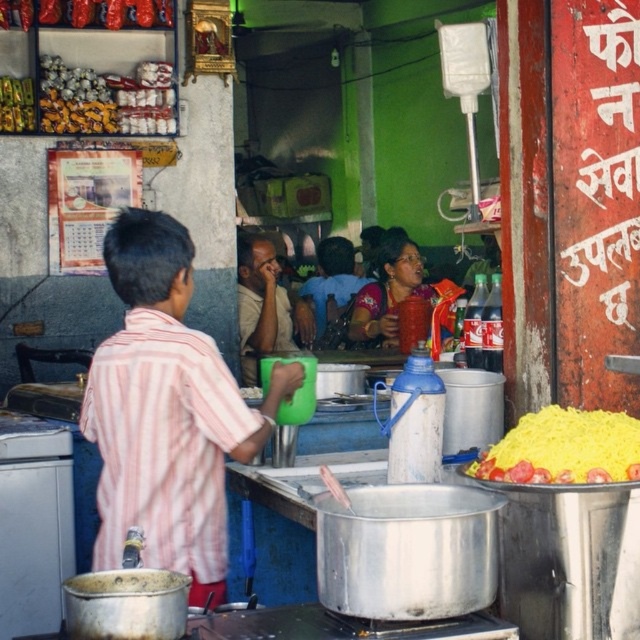
You are a customer at the food stall and want to grab the yellow rice at right without touching the matte beige shirt at center. Is this possible?

The yellow rice at right is positioned under the matte beige shirt at center, so you can grab the yellow rice at right without touching the matte beige shirt at center by reaching underneath it.

In the scene shown: You are a customer at the food stall and want to grab the yellow rice at right. Considering your arm length is 2.5 feet, can you reach it without moving closer?

The yellow rice at right is 10.06 feet away from the viewer. Since your arm length is only 2.5 feet, you cannot reach it without moving closer.

Based on the photo, you are a food stall worker who needs to reach the matte plastic cup at center while standing at the matte beige shirt at center. Can you comfortably reach it without moving your feet?

The distance between matte beige shirt at center and matte plastic cup at center is 1.04 meters. Since the average comfortable reaching distance for an adult is about 1 meter, you might need to stretch slightly but it should be reachable without moving your feet.